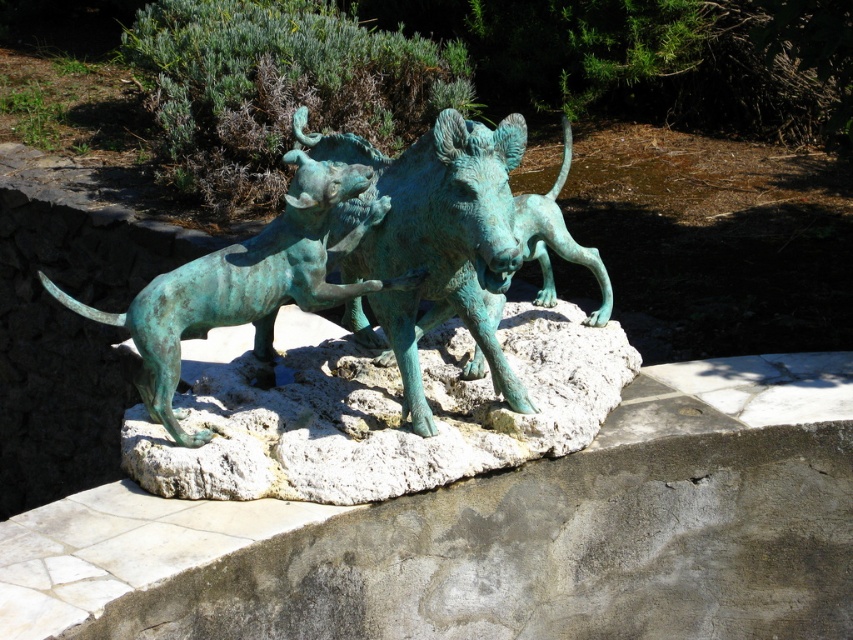
Is point (556, 337) positioned behind point (354, 156)?

That is True.

Which is in front, point (494, 440) or point (408, 304)?

Point (408, 304)

The width and height of the screenshot is (853, 640). In order to click on green patina rock at center in this screenshot , I will do `click(379, 412)`.

Who is shorter, green patina rock at center or green patina bronze dog at left?

green patina rock at center

Is green patina rock at center to the left of green patina bronze dog at left from the viewer's perspective?

In fact, green patina rock at center is to the right of green patina bronze dog at left.

The image size is (853, 640). In order to click on green patina rock at center in this screenshot , I will do `click(379, 412)`.

Which is in front, point (482, 193) or point (334, 172)?

Point (482, 193) is in front.

Can you confirm if green patina bronze boar at center is positioned below green patina bronze dog at left?

Incorrect, green patina bronze boar at center is not positioned below green patina bronze dog at left.

The image size is (853, 640). What are the coordinates of `green patina bronze boar at center` in the screenshot? It's located at (434, 237).